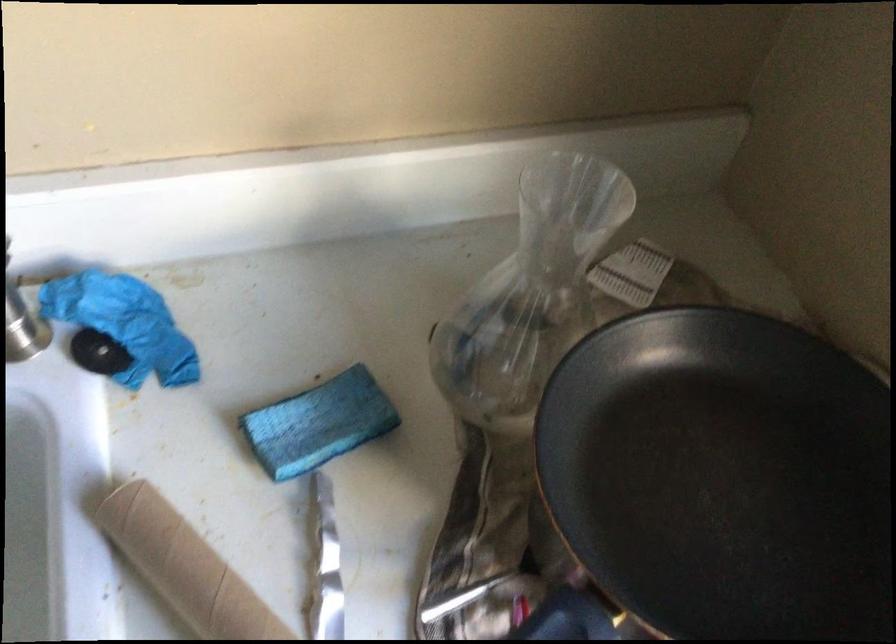
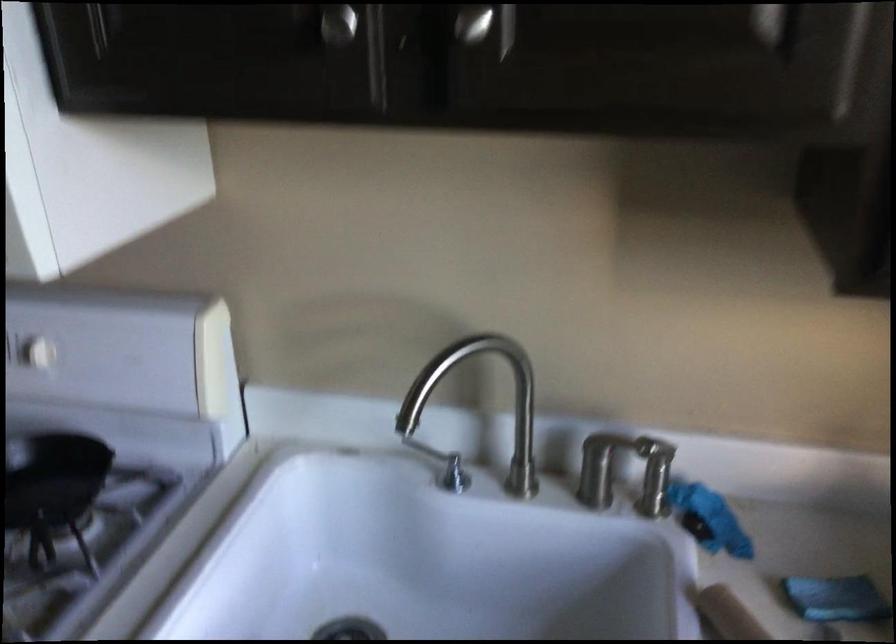
The first image is from the beginning of the video and the second image is from the end. How did the camera likely rotate when shooting the video?

The camera's rotation is toward left-up.